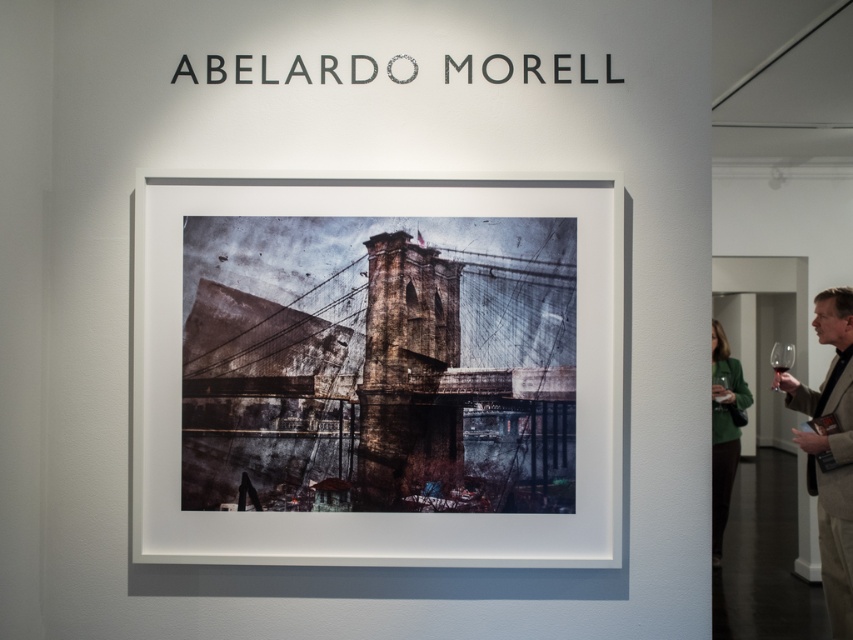
Can you confirm if green fabric coat at right is shorter than transparent glass at right?

Incorrect, green fabric coat at right's height does not fall short of transparent glass at right's.

Which is more to the right, green fabric coat at right or transparent glass at right?

green fabric coat at right is more to the right.

Between point (714, 324) and point (775, 353), which one is positioned behind?

The point (714, 324) is behind.

You are a GUI agent. You are given a task and a screenshot of the screen. Output one action in this format:
    pyautogui.click(x=<x>, y=<y>)
    Task: Click on the green fabric coat at right
    The height and width of the screenshot is (640, 853).
    Given the screenshot: What is the action you would take?
    pyautogui.click(x=724, y=429)

What do you see at coordinates (378, 364) in the screenshot?
I see `sepia-toned photograph of brooklyn bridge at center` at bounding box center [378, 364].

Is sepia-toned photograph of brooklyn bridge at center further to camera compared to green fabric coat at right?

No, it is in front of green fabric coat at right.

Where is `sepia-toned photograph of brooklyn bridge at center`? This screenshot has height=640, width=853. sepia-toned photograph of brooklyn bridge at center is located at coordinates (378, 364).

Measure the distance between green fabric coat at right and transparent glass at center.

7.49 inches

Image resolution: width=853 pixels, height=640 pixels. What do you see at coordinates (724, 429) in the screenshot?
I see `green fabric coat at right` at bounding box center [724, 429].

Where is `green fabric coat at right`? This screenshot has height=640, width=853. green fabric coat at right is located at coordinates (724, 429).